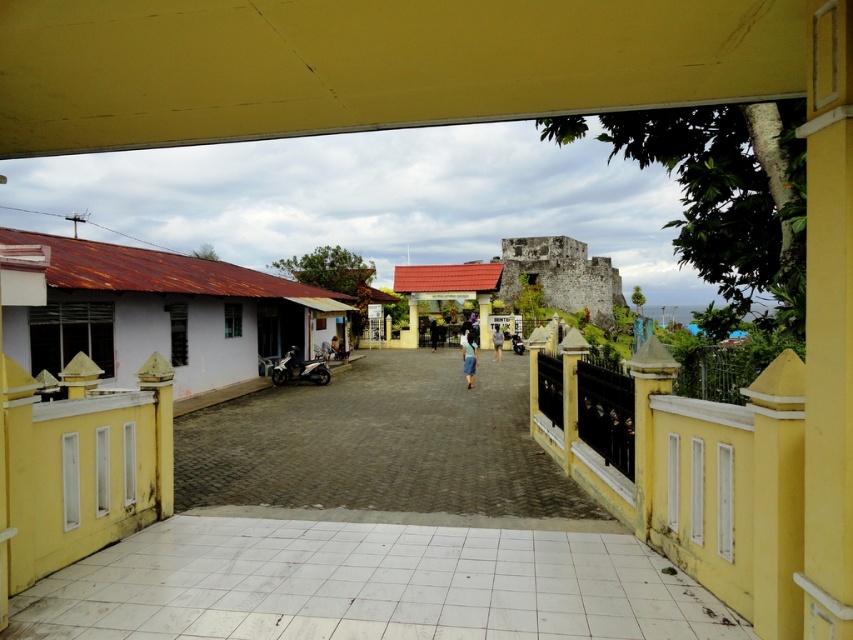
Is yellow matte pillar at right to the right of yellow painted wood post at center from the viewer's perspective?

In fact, yellow matte pillar at right is to the left of yellow painted wood post at center.

Is point (763, 452) farther from camera compared to point (564, 428)?

No, it is not.

Locate an element on the screen. The image size is (853, 640). yellow matte pillar at right is located at coordinates (776, 496).

Does white tile path at center have a greater height compared to blue fabric shirt at center?

No.

Can you confirm if white tile path at center is positioned below blue fabric shirt at center?

Indeed, white tile path at center is positioned under blue fabric shirt at center.

Is point (407, 636) behind point (497, 353)?

No, (407, 636) is closer to viewer.

Where is `white tile path at center`? This screenshot has width=853, height=640. white tile path at center is located at coordinates (368, 586).

Is point (402, 620) positioned in front of point (480, 294)?

That is True.

Is white tile path at center behind yellow matte pillar at center?

No, white tile path at center is closer to the viewer.

Where is `white tile path at center`? This screenshot has height=640, width=853. white tile path at center is located at coordinates (368, 586).

At what (x,y) coordinates should I click in order to perform the action: click on white tile path at center. Please return your answer as a coordinate pair (x, y). Looking at the image, I should click on tap(368, 586).